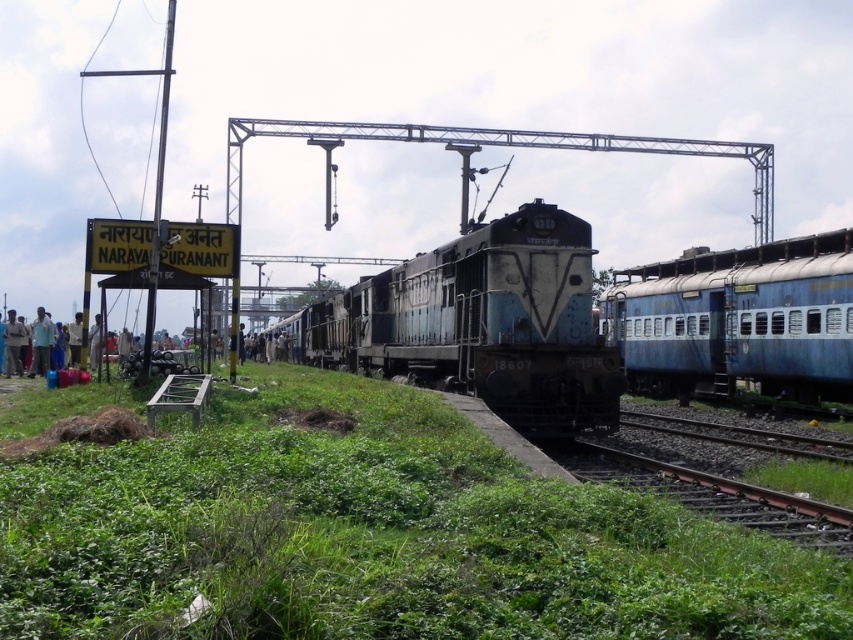
Question: Is blue painted metal passenger train at right above light brown fabric shirt at lower left?

Choices:
 (A) no
 (B) yes

Answer: (B)

Question: Which point is closer to the camera taking this photo?

Choices:
 (A) (9, 317)
 (B) (618, 340)
 (C) (607, 426)

Answer: (C)

Question: Based on their relative distances, which object is nearer to the rusty metal train track at lower right?

Choices:
 (A) blue painted metal passenger train at right
 (B) light brown fabric shirt at lower left
 (C) dirty metallic train at center
 (D) light blue shirt at left

Answer: (A)

Question: Can you confirm if light blue shirt at left is positioned below light brown fabric shirt at lower left?

Choices:
 (A) no
 (B) yes

Answer: (B)

Question: Is dirty metallic train at center wider than light brown fabric shirt at lower left?

Choices:
 (A) yes
 (B) no

Answer: (A)

Question: Which object is positioned closest to the light brown fabric shirt at lower left?

Choices:
 (A) light blue shirt at left
 (B) blue painted metal passenger train at right
 (C) dirty metallic train at center
 (D) rusty metal train track at lower right

Answer: (A)